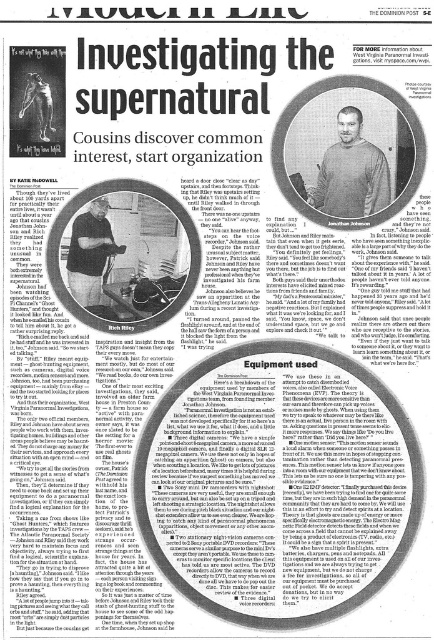
Question: Does matte gray sweater at center have a lesser width compared to matte black shirt at center?

Choices:
 (A) yes
 (B) no

Answer: (B)

Question: Among these points, which one is farthest from the camera?

Choices:
 (A) (345, 113)
 (B) (95, 208)

Answer: (B)

Question: Which object appears farthest from the camera in this image?

Choices:
 (A) matte black shirt at center
 (B) matte gray sweater at center

Answer: (A)

Question: Can you confirm if matte gray sweater at center is bigger than matte black shirt at center?

Choices:
 (A) no
 (B) yes

Answer: (B)

Question: Is matte gray sweater at center positioned before matte black shirt at center?

Choices:
 (A) yes
 (B) no

Answer: (A)